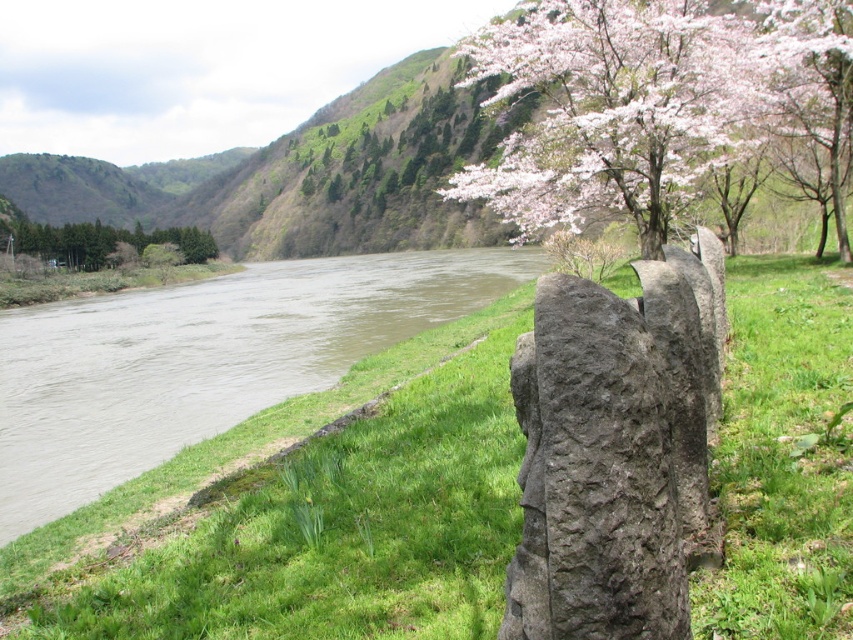
Question: Is the position of brown/muddy water at left more distant than that of pink blossom tree at upper right?

Choices:
 (A) yes
 (B) no

Answer: (B)

Question: Estimate the real-world distances between objects in this image. Which object is closer to the green textured trees at left?

Choices:
 (A) pink blossom tree at upper right
 (B) brown/muddy water at left

Answer: (B)

Question: Which of the following is the closest to the observer?

Choices:
 (A) green textured trees at left
 (B) pink blossom tree at upper right
 (C) brown/muddy water at left

Answer: (C)

Question: Which object appears farthest from the camera in this image?

Choices:
 (A) brown/muddy water at left
 (B) pink blossom tree at upper right
 (C) green textured trees at left

Answer: (C)

Question: Does brown/muddy water at left have a larger size compared to pink blossom tree at upper right?

Choices:
 (A) no
 (B) yes

Answer: (B)

Question: Where is pink blossom tree at upper right located in relation to green textured trees at left in the image?

Choices:
 (A) right
 (B) left

Answer: (A)